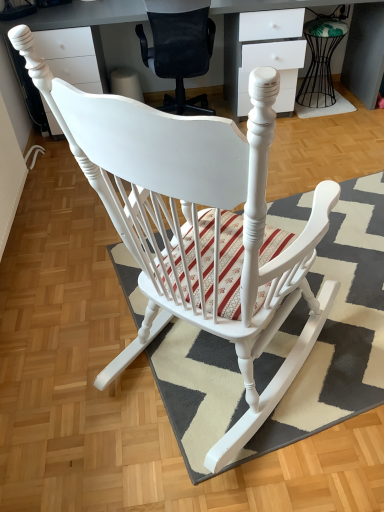
Question: Considering the positions of textured gray rug at center, placed as the 1th doormat when sorted from bottom to top, and white glossy desk at upper center in the image, is textured gray rug at center, placed as the 1th doormat when sorted from bottom to top, bigger or smaller than white glossy desk at upper center?

Choices:
 (A) big
 (B) small

Answer: (B)

Question: Which is correct: textured gray rug at center, which appears as the 1th doormat when viewed from the front, is inside white glossy desk at upper center, or outside of it?

Choices:
 (A) inside
 (B) outside

Answer: (B)

Question: Estimate the real-world distances between objects in this image. Which object is farther from the white glossy desk at upper center?

Choices:
 (A) metallic wire stool at upper right
 (B) textured gray rug at center, marked as the 2th doormat in a back-to-front arrangement
 (C) white woven mat at lower right, arranged as the second doormat when viewed from the front
 (D) white mesh office chair at center

Answer: (B)

Question: Which of these objects is positioned farthest from the white mesh office chair at center?

Choices:
 (A) metallic wire stool at upper right
 (B) textured gray rug at center, which appears as the 1th doormat when viewed from the front
 (C) white woven mat at lower right, positioned as the 2th doormat in bottom-to-top order
 (D) white glossy desk at upper center

Answer: (B)